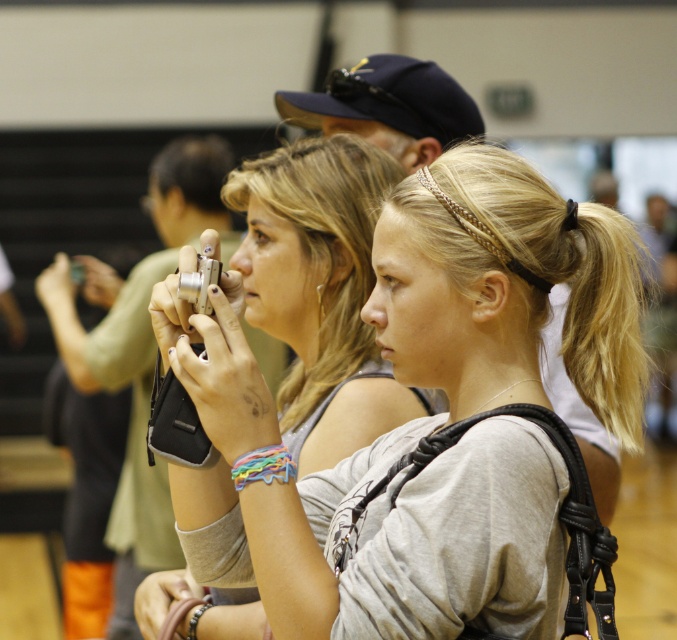
Based on the photo, you are a photographer trying to choose between the matte silver camera at center and the silver metallic camera at center. Based on their sizes, which one would you pick if you want a larger camera?

The silver metallic camera at center is larger in size compared to the matte silver camera at center, so you should choose the silver metallic camera at center if you want a larger camera.

From the picture: You are a photographer trying to decide which camera to use for a quick shot. Both the matte silver camera at center and the silver metallic camera at center are in your view. Which one is positioned to the right side?

The matte silver camera at center is positioned to the right of the silver metallic camera at center, so it is the one on the right side.